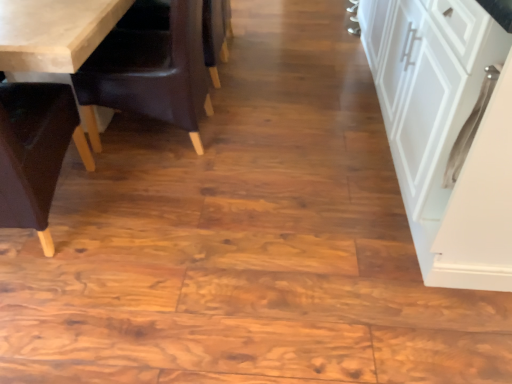
Question: Does white matte cabinet at right have a larger size compared to dark brown leather armchair at center?

Choices:
 (A) no
 (B) yes

Answer: (B)

Question: Is white matte cabinet at right closer to camera compared to dark brown leather armchair at center?

Choices:
 (A) no
 (B) yes

Answer: (B)

Question: Can you confirm if white matte cabinet at right is smaller than dark brown leather armchair at center?

Choices:
 (A) yes
 (B) no

Answer: (B)

Question: Is the surface of white matte cabinet at right in direct contact with dark brown leather armchair at center?

Choices:
 (A) no
 (B) yes

Answer: (A)

Question: Is dark brown leather armchair at center at the back of white matte cabinet at right?

Choices:
 (A) yes
 (B) no

Answer: (B)

Question: Is dark brown leather armchair at center in front of or behind white matte cabinet at right in the image?

Choices:
 (A) front
 (B) behind

Answer: (B)

Question: Does point (218, 11) appear closer or farther from the camera than point (395, 66)?

Choices:
 (A) closer
 (B) farther

Answer: (B)

Question: From the image's perspective, is dark brown leather armchair at center above or below white matte cabinet at right?

Choices:
 (A) above
 (B) below

Answer: (A)

Question: In terms of height, does dark brown leather armchair at center look taller or shorter compared to white matte cabinet at right?

Choices:
 (A) short
 (B) tall

Answer: (A)

Question: Looking at their shapes, would you say brown leather chair at left, placed as the second chair when sorted from left to right, is wider or thinner than white matte cabinet at right?

Choices:
 (A) wide
 (B) thin

Answer: (B)

Question: Is point (181, 56) positioned closer to the camera than point (468, 102)?

Choices:
 (A) farther
 (B) closer

Answer: (A)

Question: From their relative heights in the image, would you say brown leather chair at left, placed as the 1th chair when sorted from right to left, is taller or shorter than white matte cabinet at right?

Choices:
 (A) short
 (B) tall

Answer: (A)

Question: Based on their positions, is brown leather chair at left, placed as the second chair when sorted from left to right, located to the left or right of white matte cabinet at right?

Choices:
 (A) right
 (B) left

Answer: (B)

Question: Is white matte cabinet at right taller or shorter than brown leather chair at left, placed as the second chair when sorted from left to right?

Choices:
 (A) short
 (B) tall

Answer: (B)

Question: Is point (380, 18) positioned closer to the camera than point (89, 87)?

Choices:
 (A) closer
 (B) farther

Answer: (B)